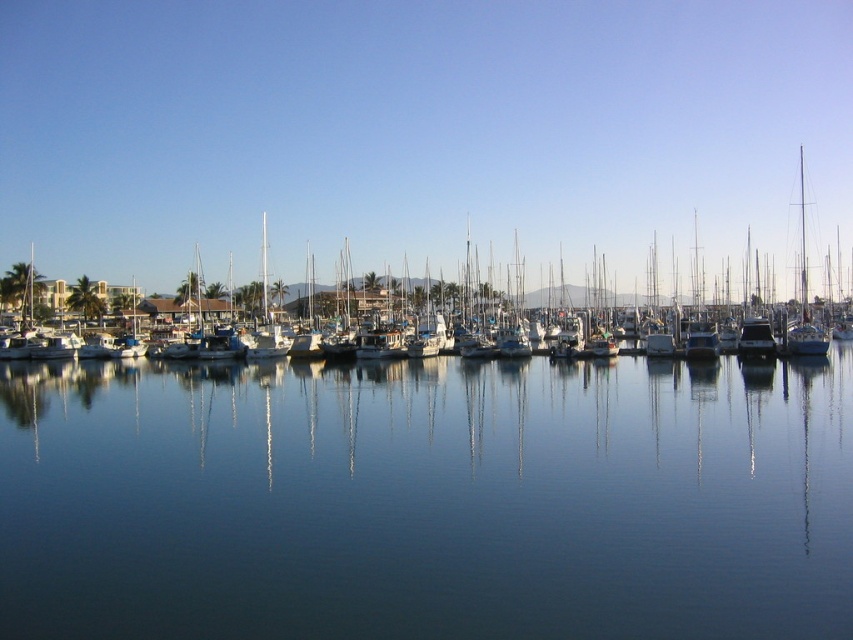
Question: Which of the following is the farthest from the observer?

Choices:
 (A) (805, 323)
 (B) (15, 333)

Answer: (B)

Question: Among these points, which one is farthest from the camera?

Choices:
 (A) (674, 410)
 (B) (412, 321)
 (C) (817, 353)

Answer: (B)

Question: In this image, where is white matte boats at center located relative to white glossy sailboat at right?

Choices:
 (A) right
 (B) left

Answer: (B)

Question: Estimate the real-world distances between objects in this image. Which object is farther from the white glossy sailboat at right?

Choices:
 (A) transparent blue water at center
 (B) white matte boats at center

Answer: (B)

Question: Is transparent blue water at center further to the viewer compared to white matte boats at center?

Choices:
 (A) yes
 (B) no

Answer: (B)

Question: Can you confirm if white matte boats at center is positioned below white glossy sailboat at right?

Choices:
 (A) yes
 (B) no

Answer: (B)